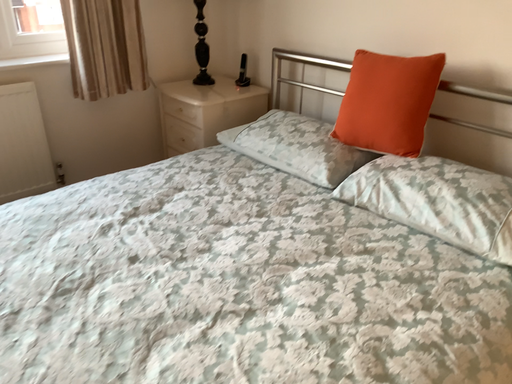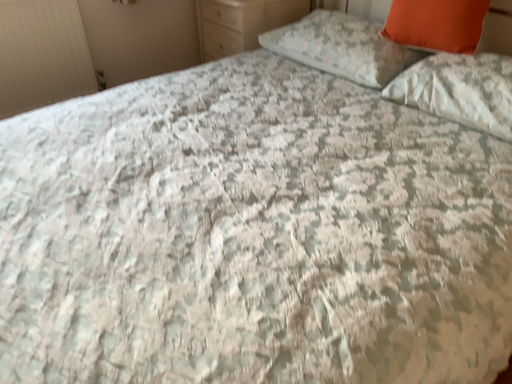
Question: Which way did the camera rotate in the video?

Choices:
 (A) rotated downward
 (B) rotated upward

Answer: (A)